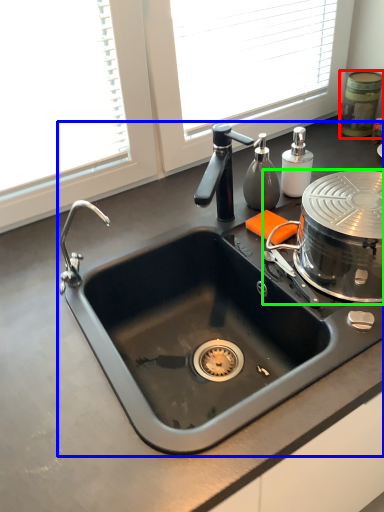
Question: Based on their relative distances, which object is nearer to appliance (highlighted by a red box)? Choose from sink (highlighted by a blue box) and appliance (highlighted by a green box).

Choices:
 (A) sink
 (B) appliance

Answer: (B)